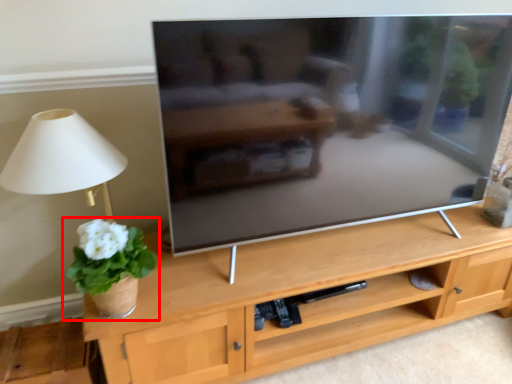
Question: From the image's perspective, where is houseplant (annotated by the red box) located relative to table lamp?

Choices:
 (A) below
 (B) above

Answer: (A)